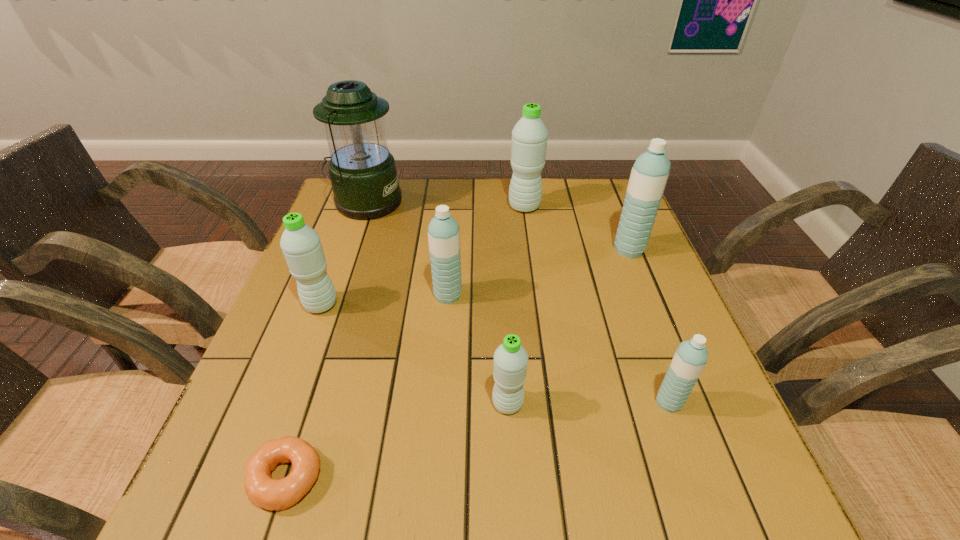
Locate an element on the screen. The image size is (960, 540). vacant space located 0.350m on the left of the smallest blue water bottle is located at coordinates (466, 402).

Locate an element on the screen. The width and height of the screenshot is (960, 540). free space located on the back of the tan doughnut is located at coordinates (329, 345).

Where is `lantern that is at the far edge`? This screenshot has width=960, height=540. lantern that is at the far edge is located at coordinates (363, 174).

Locate an element on the screen. This screenshot has width=960, height=540. water bottle positioned at the far edge is located at coordinates (529, 136).

In order to click on object at the near edge in this screenshot , I will do `click(263, 491)`.

Where is `lantern that is at the left edge`? lantern that is at the left edge is located at coordinates (363, 174).

Image resolution: width=960 pixels, height=540 pixels. Identify the location of water bottle that is at the left edge. (301, 245).

The height and width of the screenshot is (540, 960). I want to click on doughnut situated at the left edge, so click(x=263, y=491).

Where is `object that is positioned at the far left corner`? This screenshot has width=960, height=540. object that is positioned at the far left corner is located at coordinates (363, 174).

At what (x,y) coordinates should I click in order to perform the action: click on object that is at the near left corner. Please return your answer as a coordinate pair (x, y). Looking at the image, I should click on (263, 491).